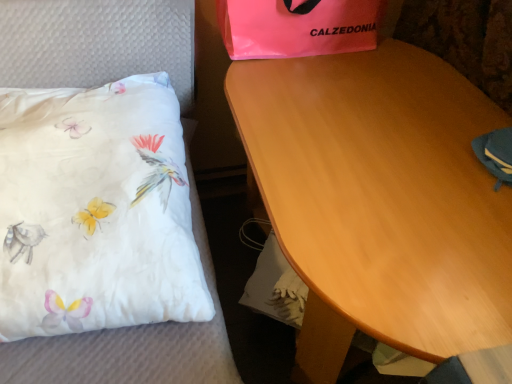
Find the location of a particular element. white satin pillow at left is located at coordinates (96, 43).

Looking at this image, does wooden table at center appear on the right side of white satin pillow at left?

Yes.

Between wooden table at center and white satin pillow at left, which one has smaller size?

white satin pillow at left is smaller.

Is point (315, 83) positioned in front of point (169, 9)?

No.

How many degrees apart are the facing directions of wooden table at center and white satin pillow at left?

There is a 87.3-degree angle between the facing directions of wooden table at center and white satin pillow at left.

Which object is wider, wooden table at center or pink plastic bag at upper center?

wooden table at center is wider.

Is the depth of wooden table at center less than that of pink plastic bag at upper center?

That is True.

Is point (413, 65) farther from viewer compared to point (230, 50)?

No, it is in front of (230, 50).

Identify the location of table on the right of the pink plastic bag at upper center. The width and height of the screenshot is (512, 384). (380, 200).

Is white satin pillow at left outside of pink plastic bag at upper center?

Yes, white satin pillow at left is outside of pink plastic bag at upper center.

Is white satin pillow at left oriented away from pink plastic bag at upper center?

No, pink plastic bag at upper center is not at the back of white satin pillow at left.

Considering the relative positions of white satin pillow at left and pink plastic bag at upper center in the image provided, is white satin pillow at left to the right of pink plastic bag at upper center from the viewer's perspective?

No, white satin pillow at left is not to the right of pink plastic bag at upper center.

From the image's perspective, would you say white satin pillow at left is positioned over pink plastic bag at upper center?

Actually, white satin pillow at left appears below pink plastic bag at upper center in the image.

Which of these two, pink plastic bag at upper center or white satin pillow at left, is bigger?

white satin pillow at left is bigger.

From the image's perspective, is pink plastic bag at upper center above or below white satin pillow at left?

pink plastic bag at upper center is situated higher than white satin pillow at left in the image.

The height and width of the screenshot is (384, 512). I want to click on furniture below the pink plastic bag at upper center (from the image's perspective), so click(x=96, y=43).

Is pink plastic bag at upper center situated inside white satin pillow at left or outside?

pink plastic bag at upper center lies outside white satin pillow at left.

Do you think white satin pillow at left is within wooden table at center, or outside of it?

white satin pillow at left is outside wooden table at center.

From the image's perspective, which object appears higher, white satin pillow at left or wooden table at center?

white satin pillow at left is shown above in the image.

Are white satin pillow at left and wooden table at center located far from each other?

white satin pillow at left is actually quite close to wooden table at center.

From the image's perspective, between pink plastic bag at upper center and wooden table at center, who is located below?

wooden table at center is shown below in the image.

Is wooden table at center located within pink plastic bag at upper center?

Definitely not — wooden table at center is not inside pink plastic bag at upper center.

Does point (322, 9) appear closer or farther from the camera than point (373, 86)?

Point (322, 9) is farther from the camera than point (373, 86).

I want to click on table below the white satin pillow at left (from a real-world perspective), so click(x=380, y=200).

This screenshot has width=512, height=384. I want to click on gift bag behind the wooden table at center, so click(x=298, y=27).

When comparing their distances from pink plastic bag at upper center, does wooden table at center or white satin pillow at left seem closer?

white satin pillow at left is closer to pink plastic bag at upper center.

When comparing their distances from wooden table at center, does white satin pillow at left or pink plastic bag at upper center seem further?

Based on the image, white satin pillow at left appears to be further to wooden table at center.

Looking at the image, which one is located further to white satin pillow at left, wooden table at center or pink plastic bag at upper center?

wooden table at center lies further to white satin pillow at left than the other object.

Based on their spatial positions, is white satin pillow at left or wooden table at center further from pink plastic bag at upper center?

wooden table at center.

Based on their spatial positions, is pink plastic bag at upper center or wooden table at center closer to white satin pillow at left?

Among the two, pink plastic bag at upper center is located nearer to white satin pillow at left.

Based on their spatial positions, is pink plastic bag at upper center or white satin pillow at left further from wooden table at center?

Among the two, white satin pillow at left is located further to wooden table at center.

Identify the location of gift bag situated between white satin pillow at left and wooden table at center from left to right. Image resolution: width=512 pixels, height=384 pixels. click(298, 27).